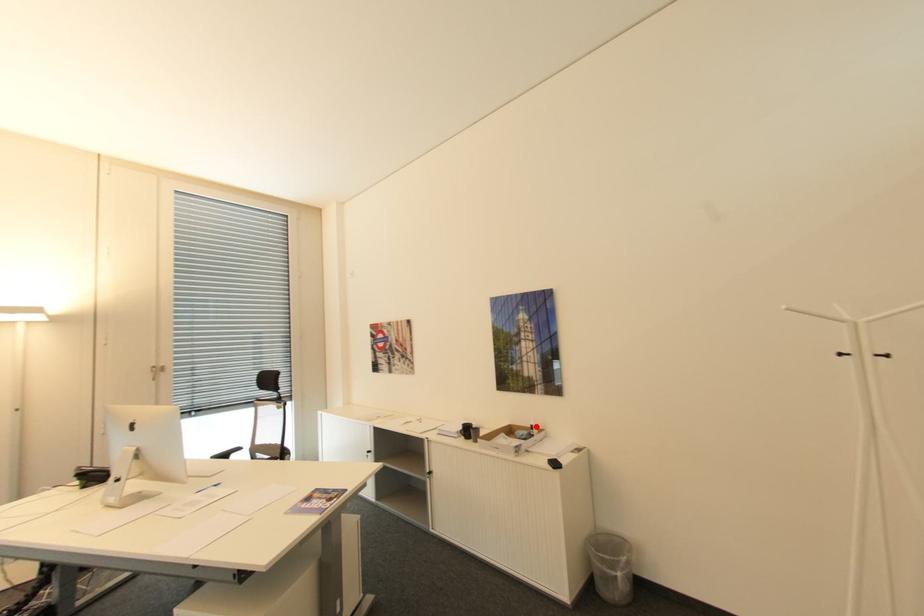
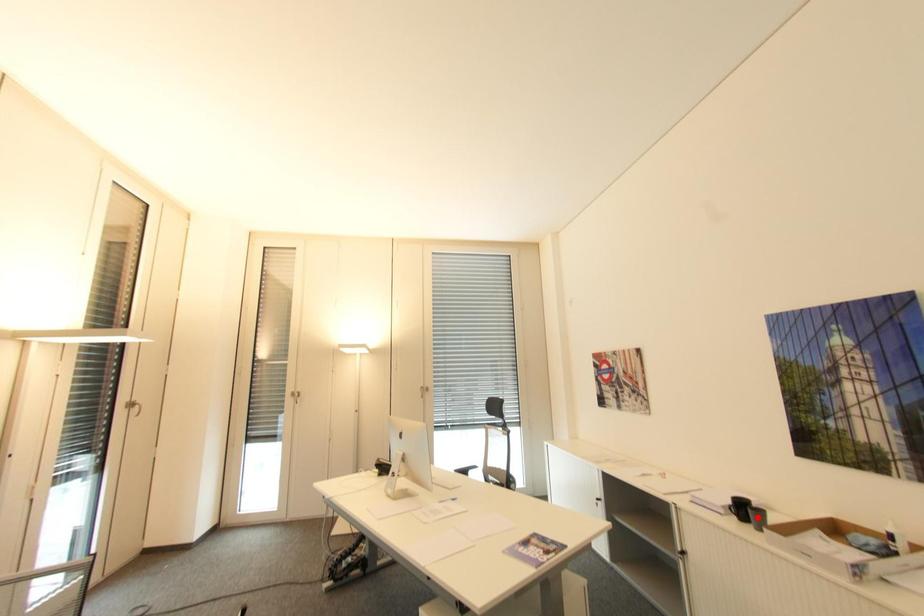
I am providing you with two images of the same scene from different viewpoints. A red point is marked on the first image and another point is marked on the second image. Do the highlighted points in image1 and image2 indicate the same real-world spot?

No